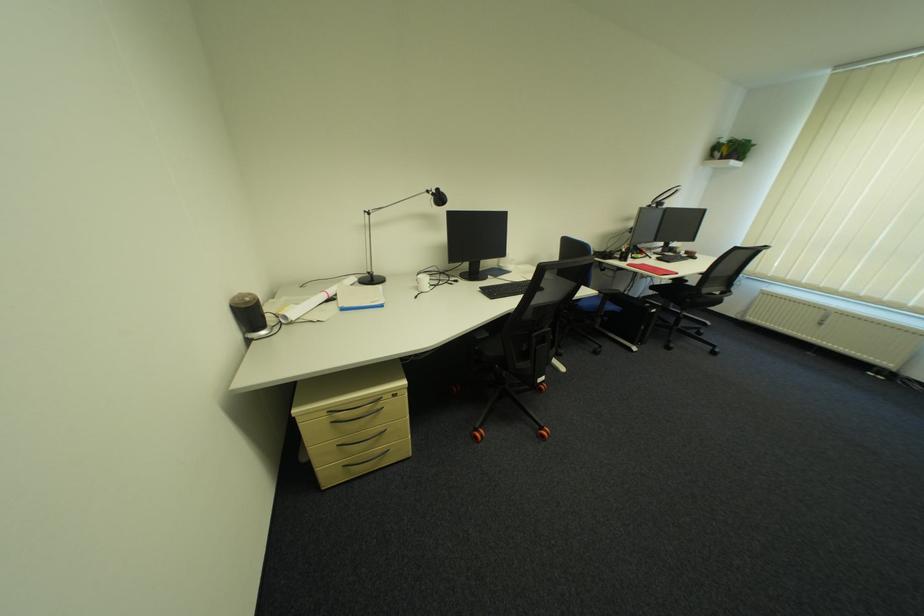
What do you see at coordinates (438, 197) in the screenshot? I see `a black lamp head` at bounding box center [438, 197].